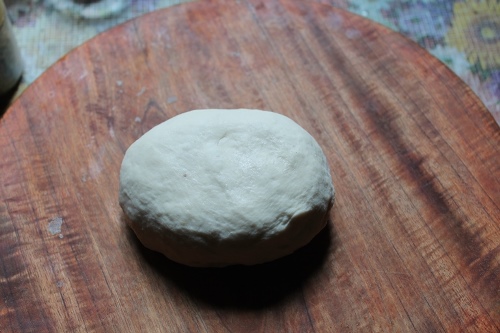
The image size is (500, 333). Identify the location of table cloth. (455, 31), (49, 30).